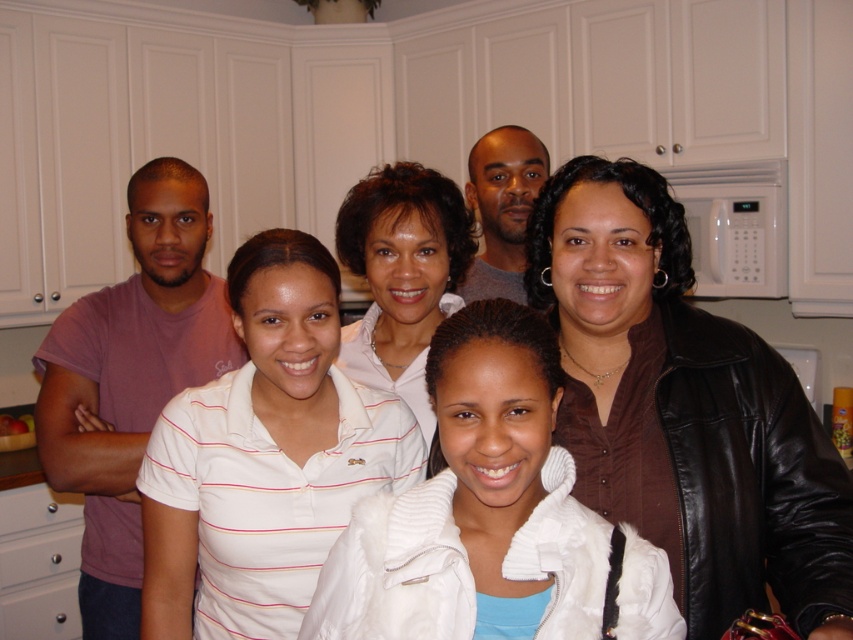
You are a photographer standing in the kitchen scene. You want to take a closeup shot of the brown leather jacket at upper right without moving any objects. Can you get a clear closeup shot if your camera has a minimum focusing distance of 3 feet?

The distance between the brown leather jacket at upper right and the camera is 3.29 feet, which is greater than the camera minimum focusing distance of 3 feet. Therefore, you can take a clear closeup shot of the brown leather jacket at upper right without moving any objects.

You are a photographer trying to adjust the group photo setup. You want to ensure that the brown leather jacket at upper right and the white matte jacket at center are aligned properly. Which jacket should you move to the left to create symmetry between them?

The brown leather jacket at upper right should be moved to the left so that it aligns symmetrically with the white matte jacket at center, as it is currently positioned on the right side of the white matte jacket at center.